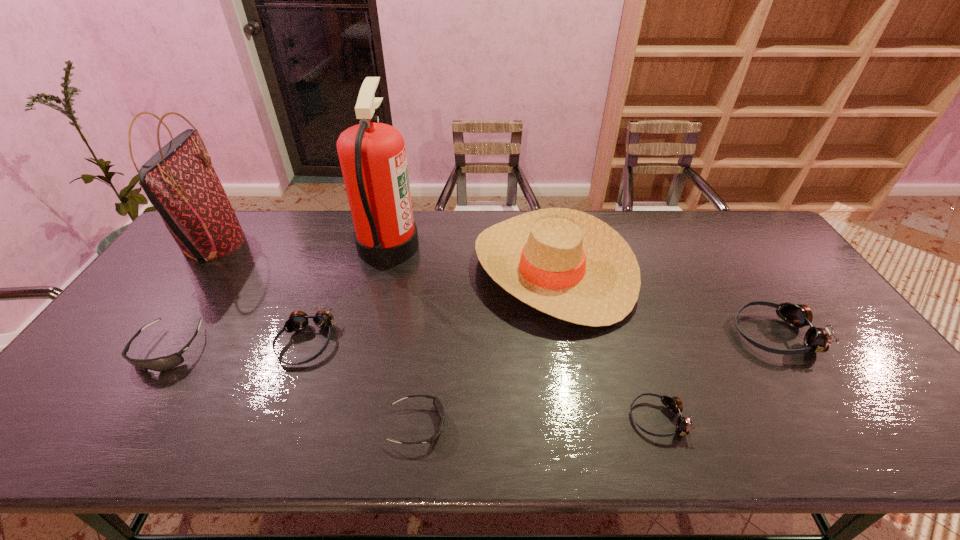
Where is `bronze goggles that is the closest to the red fire extinguisher`? bronze goggles that is the closest to the red fire extinguisher is located at coordinates (298, 320).

Point out which bronze goggles is positioned as the second nearest to the second smallest bronze goggles. Please provide its 2D coordinates. Your answer should be formatted as a tuple, i.e. [(x, y)], where the tuple contains the x and y coordinates of a point satisfying the conditions above.

[(818, 340)]

Where is `vacant region that satisfies the following two spatial constraints: 1. at the nozzle of the fire extinguisher; 2. through the lenses of the second biggest bronze goggles`? Image resolution: width=960 pixels, height=540 pixels. vacant region that satisfies the following two spatial constraints: 1. at the nozzle of the fire extinguisher; 2. through the lenses of the second biggest bronze goggles is located at coordinates (364, 342).

Locate an element on the screen. free location that satisfies the following two spatial constraints: 1. through the lenses of the rightmost object; 2. through the lenses of the second smallest bronze goggles is located at coordinates (780, 342).

You are a GUI agent. You are given a task and a screenshot of the screen. Output one action in this format:
    pyautogui.click(x=<x>, y=<y>)
    Task: Click on the free spot that satisfies the following two spatial constraints: 1. at the nozzle of the fire extinguisher; 2. on the left side of the sixth shortest object
    This screenshot has height=540, width=960.
    Given the screenshot: What is the action you would take?
    click(382, 270)